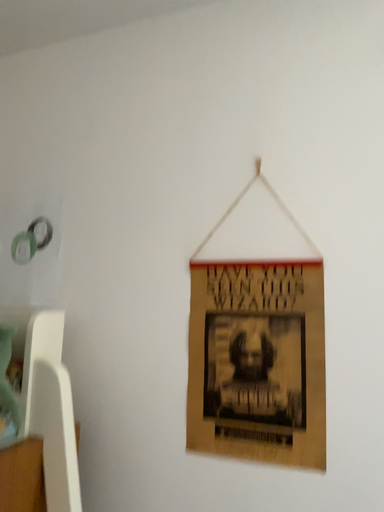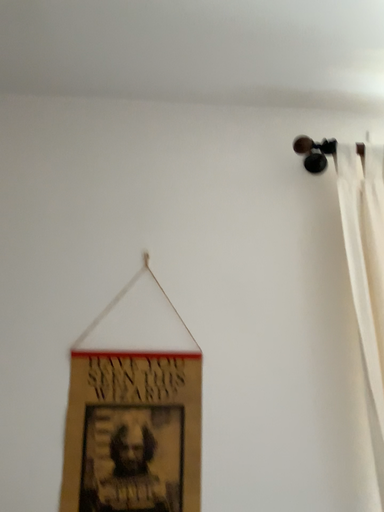
Question: Which way did the camera rotate in the video?

Choices:
 (A) rotated left
 (B) rotated right

Answer: (B)